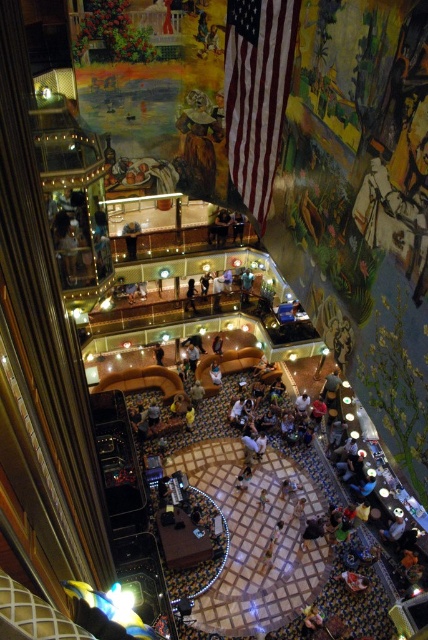
Looking at this image, can you confirm if light brown leather jacket at center is positioned above light brown leather couch at center?

Indeed, light brown leather jacket at center is positioned over light brown leather couch at center.

Does light brown leather jacket at center have a greater width compared to light brown leather couch at center?

Correct, the width of light brown leather jacket at center exceeds that of light brown leather couch at center.

This screenshot has width=428, height=640. What do you see at coordinates (193, 355) in the screenshot?
I see `light brown leather jacket at center` at bounding box center [193, 355].

Find the location of a particular element. This screenshot has width=428, height=640. light brown leather jacket at center is located at coordinates (193, 355).

Which is behind, point (189, 348) or point (219, 346)?

Positioned behind is point (189, 348).

Which of these two, light brown leather jacket at center or dark brown leather couch at center, stands shorter?

With less height is dark brown leather couch at center.

Is point (198, 349) positioned behind point (211, 348)?

No, (198, 349) is closer to viewer.

I want to click on light brown leather jacket at center, so click(193, 355).

Does light brown leather jacket at center appear on the right side of dark blue shirt at center?

Yes, light brown leather jacket at center is to the right of dark blue shirt at center.

This screenshot has width=428, height=640. Describe the element at coordinates (193, 355) in the screenshot. I see `light brown leather jacket at center` at that location.

Measure the distance between point (189, 348) and camera.

The distance of point (189, 348) from camera is 27.53 meters.

Image resolution: width=428 pixels, height=640 pixels. Identify the location of light brown leather jacket at center. (193, 355).